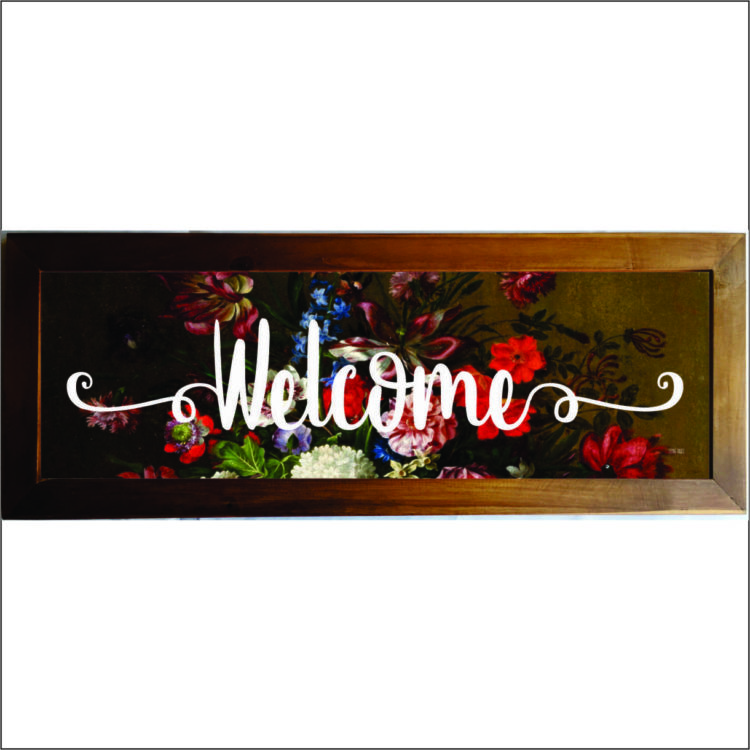
Locate an element on the screen. Image resolution: width=750 pixels, height=750 pixels. left vertical segment of frame is located at coordinates (18, 375).